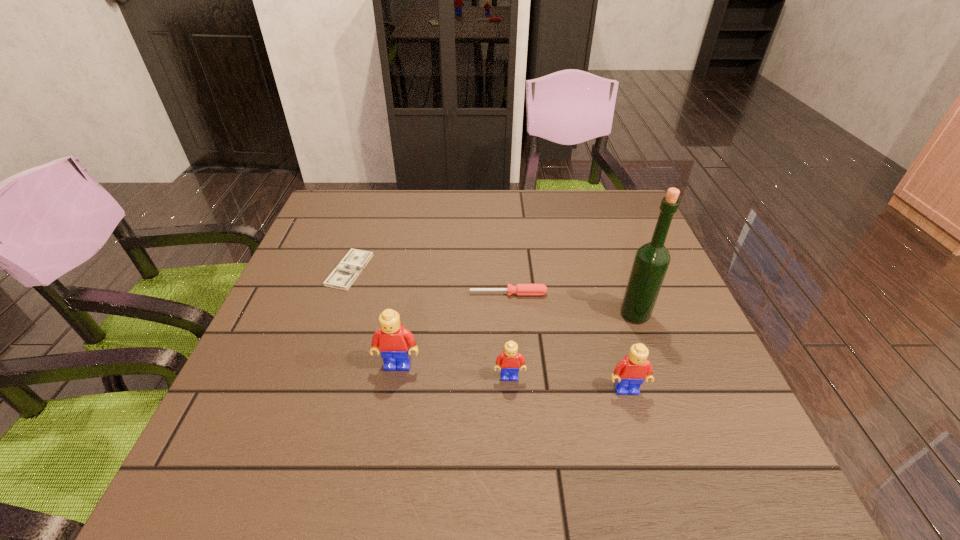
Choose which Lego is the second nearest neighbor to the liquor. Please provide its 2D coordinates. Your answer should be formatted as a tuple, i.e. [(x, y)], where the tuple contains the x and y coordinates of a point satisfying the conditions above.

[(508, 363)]

The image size is (960, 540). Find the location of `Lego that is the second closest to the fourth nearest object`. Lego that is the second closest to the fourth nearest object is located at coordinates (508, 363).